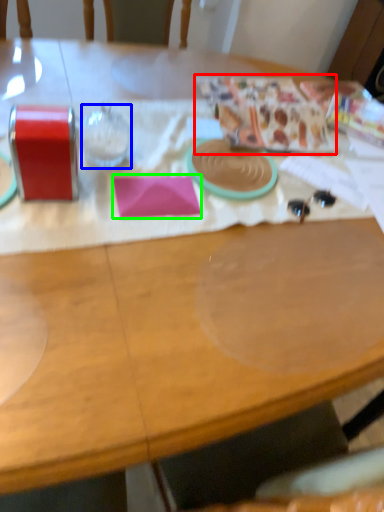
Question: Based on their relative distances, which object is nearer to wrapping paper (highlighted by a red box)? Choose from wine glass (highlighted by a blue box) and notepad (highlighted by a green box).

Choices:
 (A) wine glass
 (B) notepad

Answer: (B)